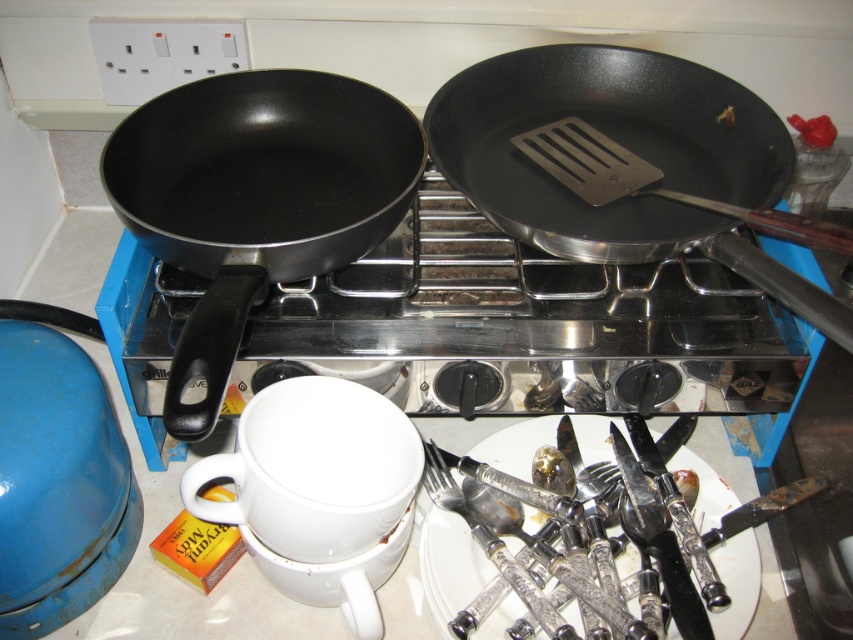
Describe the element at coordinates (256, 198) in the screenshot. The image size is (853, 640). I see `matte black frying pan at left` at that location.

How far apart are matte black frying pan at left and polished silverware at center?

13.55 inches

This screenshot has height=640, width=853. Describe the element at coordinates (256, 198) in the screenshot. I see `matte black frying pan at left` at that location.

Locate an element on the screen. matte black frying pan at left is located at coordinates (256, 198).

Is matte black frying pan at left to the left of matte black frying pan at upper right from the viewer's perspective?

Yes, matte black frying pan at left is to the left of matte black frying pan at upper right.

Who is more distant from viewer, (165, 154) or (740, 198)?

Positioned behind is point (165, 154).

Is point (277, 88) closer to viewer compared to point (688, 100)?

Yes, point (277, 88) is in front of point (688, 100).

Identify the location of matte black frying pan at left. This screenshot has height=640, width=853. (256, 198).

Is matte black frying pan at upper right to the left of black matte pan at upper left from the viewer's perspective?

No, matte black frying pan at upper right is not to the left of black matte pan at upper left.

Describe the element at coordinates (631, 150) in the screenshot. I see `matte black frying pan at upper right` at that location.

I want to click on matte black frying pan at upper right, so click(631, 150).